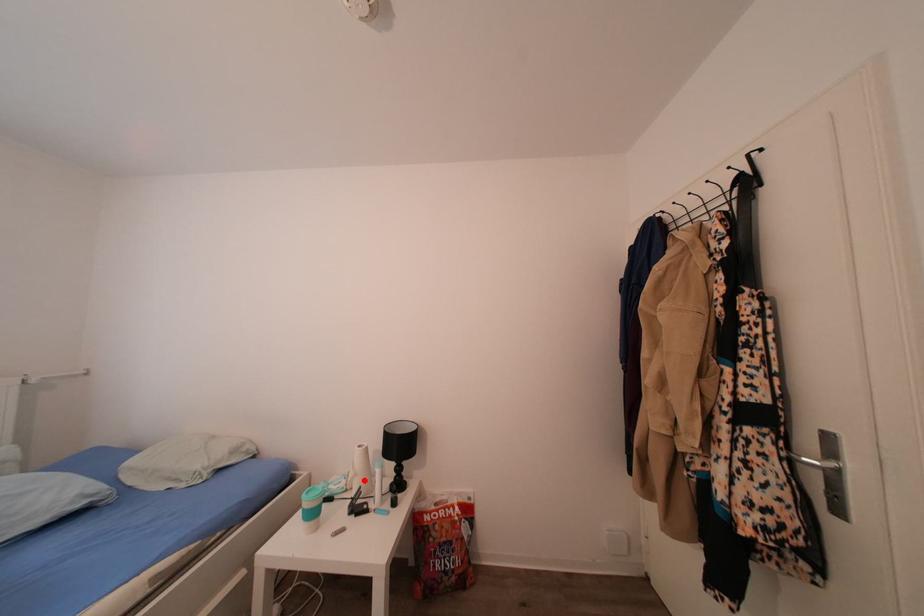
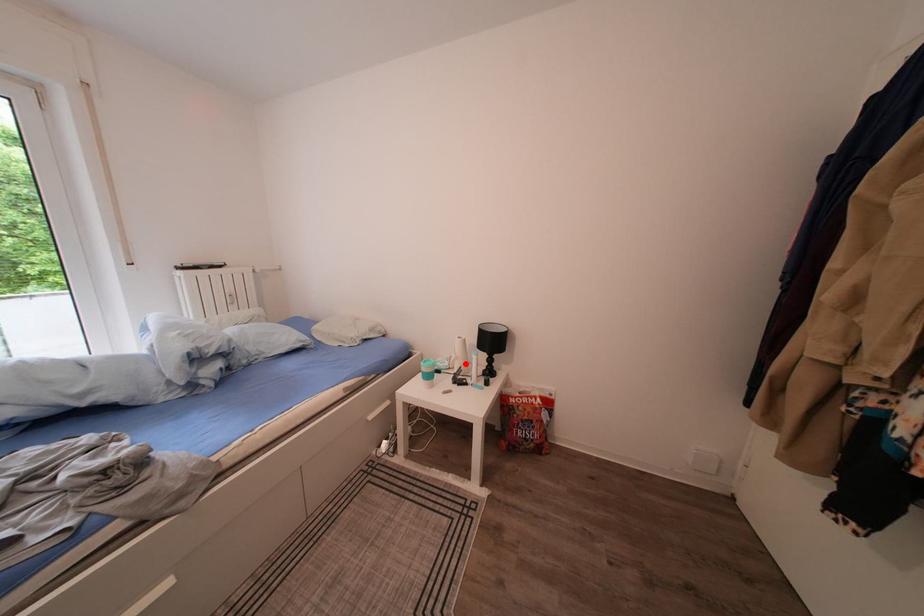
I am providing you with two images of the same scene from different viewpoints. A red point is marked on the first image and another point is marked on the second image. Are the points marked in image1 and image2 representing the same 3D position?

Yes